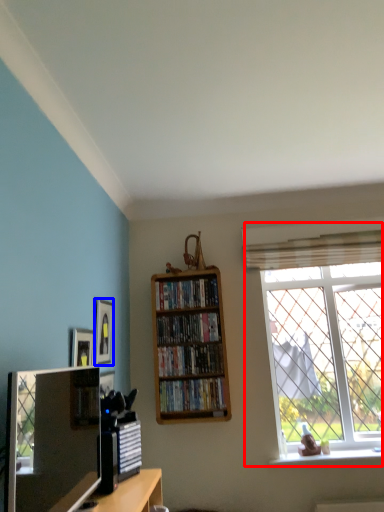
Question: Which object appears closest to the camera in this image, window (highlighted by a red box) or picture frame (highlighted by a blue box)?

Choices:
 (A) window
 (B) picture frame

Answer: (B)